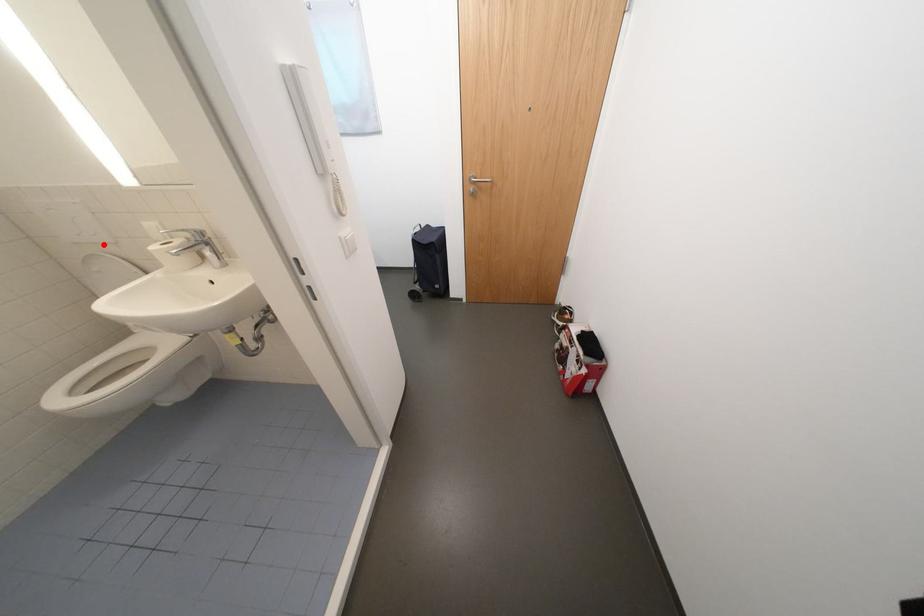
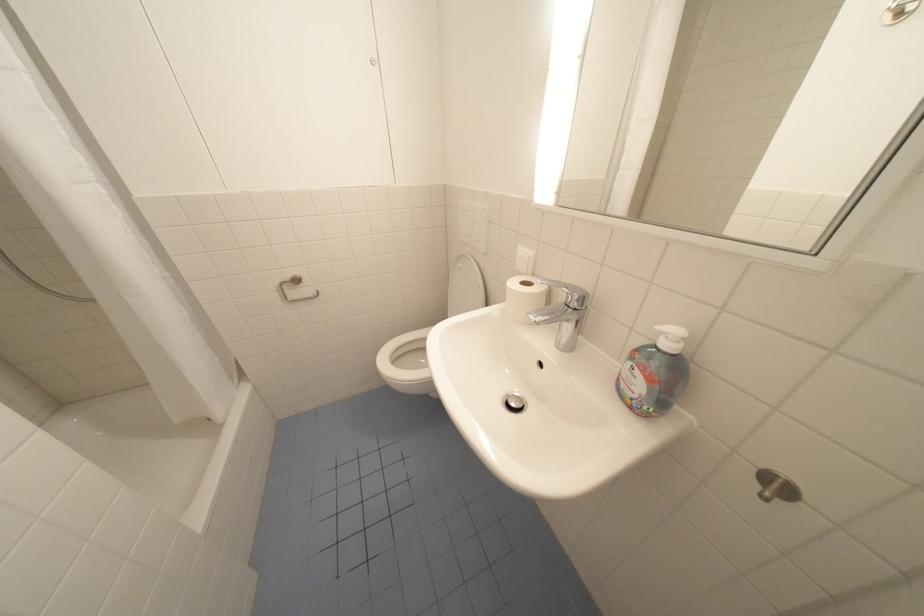
Locate, in the second image, the point that corresponds to the highlighted location in the first image.

(480, 248)